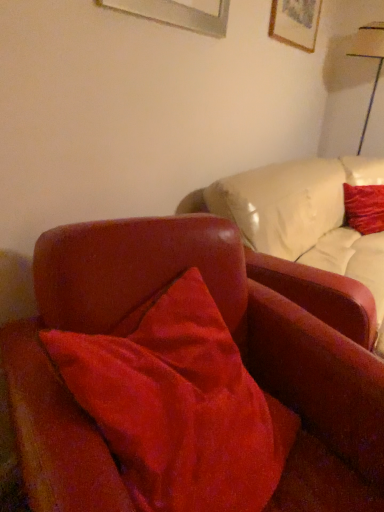
Question: Is point (377, 205) positioned closer to the camera than point (326, 479)?

Choices:
 (A) closer
 (B) farther

Answer: (B)

Question: Is velvet red pillow at upper right wider or thinner than velvet red chair at center?

Choices:
 (A) wide
 (B) thin

Answer: (B)

Question: Which is farther from the velvet red chair at center?

Choices:
 (A) white glossy table lamp at upper right
 (B) velvet red pillow at upper right
 (C) wooden picture frame at upper right

Answer: (A)

Question: Which of these objects is positioned closest to the wooden picture frame at upper right?

Choices:
 (A) white glossy table lamp at upper right
 (B) velvet red pillow at upper right
 (C) velvet red chair at center

Answer: (A)